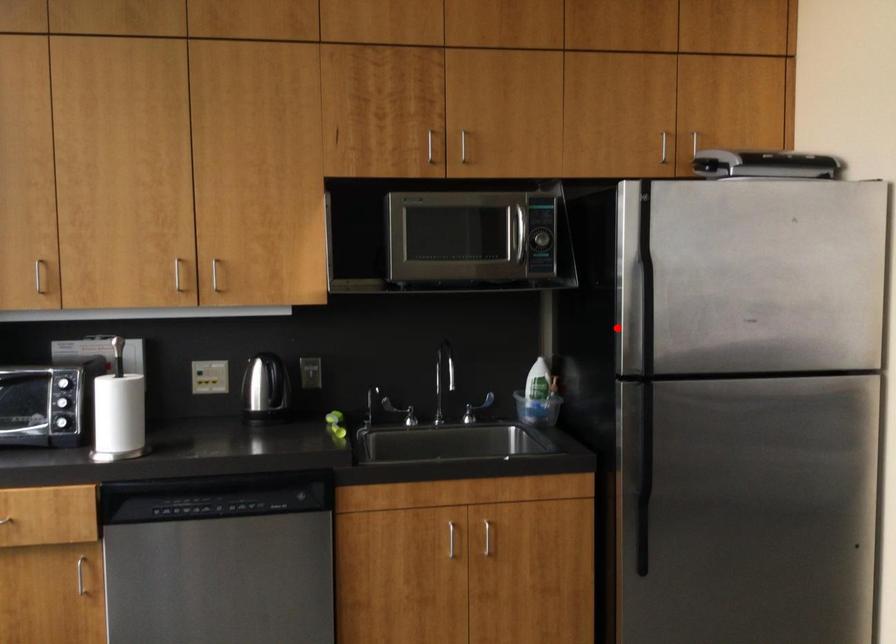
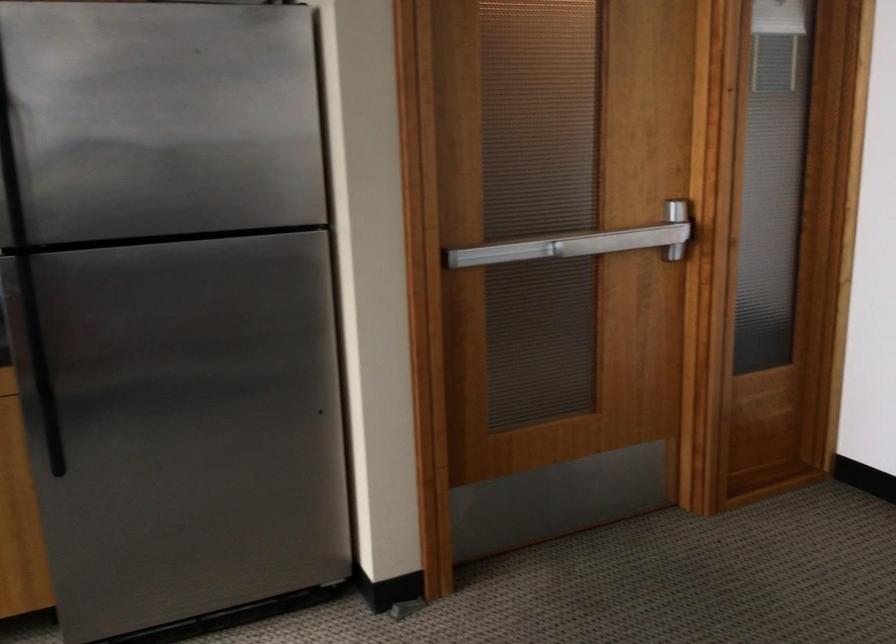
The point at the highlighted location is marked in the first image. Where is the corresponding point in the second image?

(10, 198)